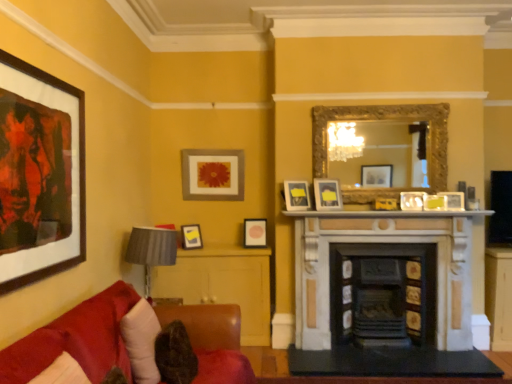
Question: Can you confirm if white fabric pillow at lower left is bigger than matte black picture frame at center, the 7th picture frame when ordered from front to back?

Choices:
 (A) yes
 (B) no

Answer: (A)

Question: Does white fabric pillow at lower left appear on the right side of matte black picture frame at center, the 2th picture frame in the back-to-front sequence?

Choices:
 (A) no
 (B) yes

Answer: (A)

Question: From the image's perspective, is white fabric pillow at lower left below matte black picture frame at center, the 4th picture frame viewed from the left?

Choices:
 (A) yes
 (B) no

Answer: (A)

Question: Can we say white fabric pillow at lower left lies outside matte black picture frame at center, the 5th picture frame viewed from the right?

Choices:
 (A) yes
 (B) no

Answer: (A)

Question: Is white fabric pillow at lower left far away from matte black picture frame at center, the 2th picture frame in the back-to-front sequence?

Choices:
 (A) no
 (B) yes

Answer: (B)

Question: From their relative heights in the image, would you say matte white picture frame at center, marked as the 3th picture frame in a front-to-back arrangement, is taller or shorter than velvet red couch at lower left?

Choices:
 (A) short
 (B) tall

Answer: (A)

Question: Is point (321, 192) closer or farther from the camera than point (31, 340)?

Choices:
 (A) closer
 (B) farther

Answer: (B)

Question: In the image, is matte white picture frame at center, marked as the 3th picture frame in a front-to-back arrangement, positioned in front of or behind velvet red couch at lower left?

Choices:
 (A) behind
 (B) front

Answer: (A)

Question: From the image's perspective, is matte white picture frame at center, marked as the sixth picture frame in a back-to-front arrangement, positioned above or below velvet red couch at lower left?

Choices:
 (A) above
 (B) below

Answer: (A)

Question: Which is correct: gold ornate mirror at upper center is inside marble fireplace at center, positioned as the 2th fireplace in right-to-left order, or outside of it?

Choices:
 (A) outside
 (B) inside

Answer: (A)

Question: From a real-world perspective, is gold ornate mirror at upper center positioned above or below marble fireplace at center, positioned as the 2th fireplace in right-to-left order?

Choices:
 (A) above
 (B) below

Answer: (A)

Question: Considering the positions of point (444, 107) and point (373, 221), is point (444, 107) closer or farther from the camera than point (373, 221)?

Choices:
 (A) farther
 (B) closer

Answer: (A)

Question: Considering the relative positions of gold ornate mirror at upper center and marble fireplace at center, positioned as the 2th fireplace in right-to-left order, in the image provided, is gold ornate mirror at upper center to the left or to the right of marble fireplace at center, positioned as the 2th fireplace in right-to-left order,?

Choices:
 (A) left
 (B) right

Answer: (A)

Question: Does point click(x=412, y=211) appear closer or farther from the camera than point click(x=428, y=147)?

Choices:
 (A) closer
 (B) farther

Answer: (A)

Question: Do you think marble fireplace at center, which is the 1th fireplace in left-to-right order, is within gold ornate mirror at upper center, or outside of it?

Choices:
 (A) outside
 (B) inside

Answer: (A)